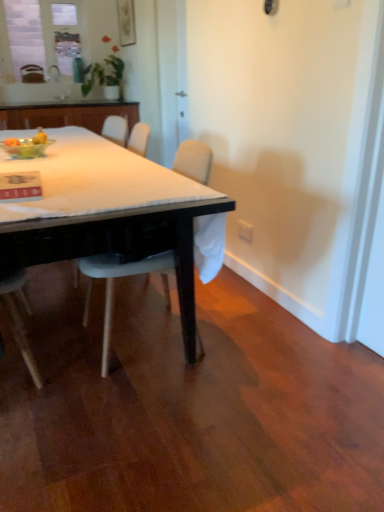
Identify the location of vacant area that lies to the right of white plastic chair at center, the first chair from the bottom. This screenshot has width=384, height=512. (248, 337).